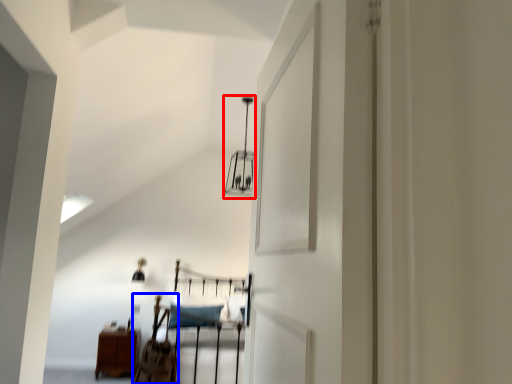
Question: Which object appears farthest to the camera in this image, light fixture (highlighted by a red box) or chair (highlighted by a blue box)?

Choices:
 (A) light fixture
 (B) chair

Answer: (A)